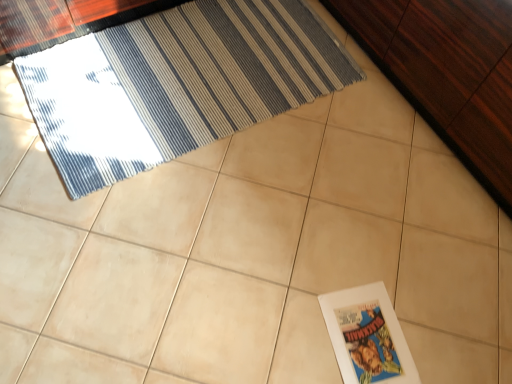
Question: Considering their positions, is blue striped rug at upper left located in front of or behind white paper at lower right?

Choices:
 (A) behind
 (B) front

Answer: (A)

Question: Considering the positions of blue striped rug at upper left and white paper at lower right in the image, is blue striped rug at upper left taller or shorter than white paper at lower right?

Choices:
 (A) tall
 (B) short

Answer: (A)

Question: Which is nearer to the blue striped rug at upper left?

Choices:
 (A) dark wood dresser at upper right
 (B) white paper at lower right

Answer: (A)

Question: Which is farther from the dark wood dresser at upper right?

Choices:
 (A) blue striped rug at upper left
 (B) white paper at lower right

Answer: (B)